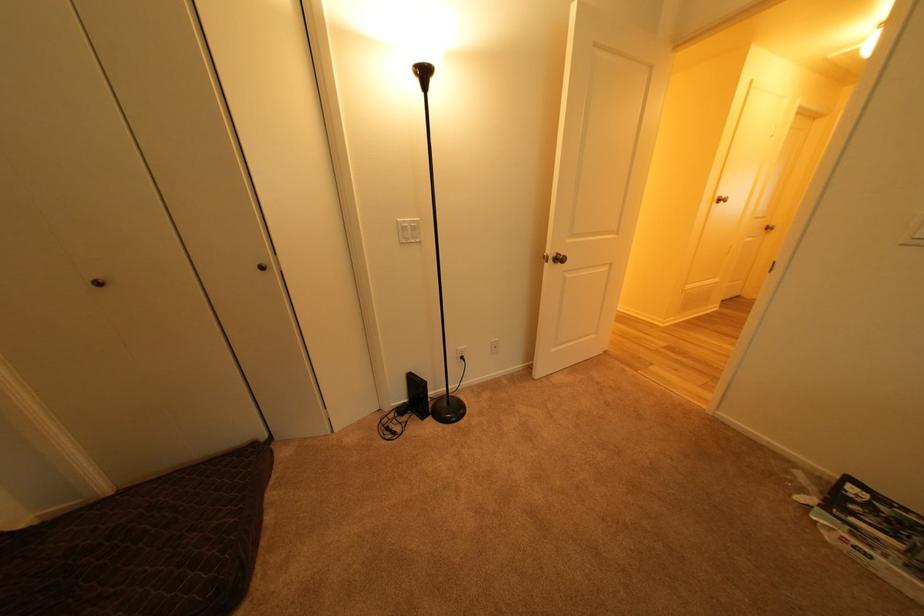
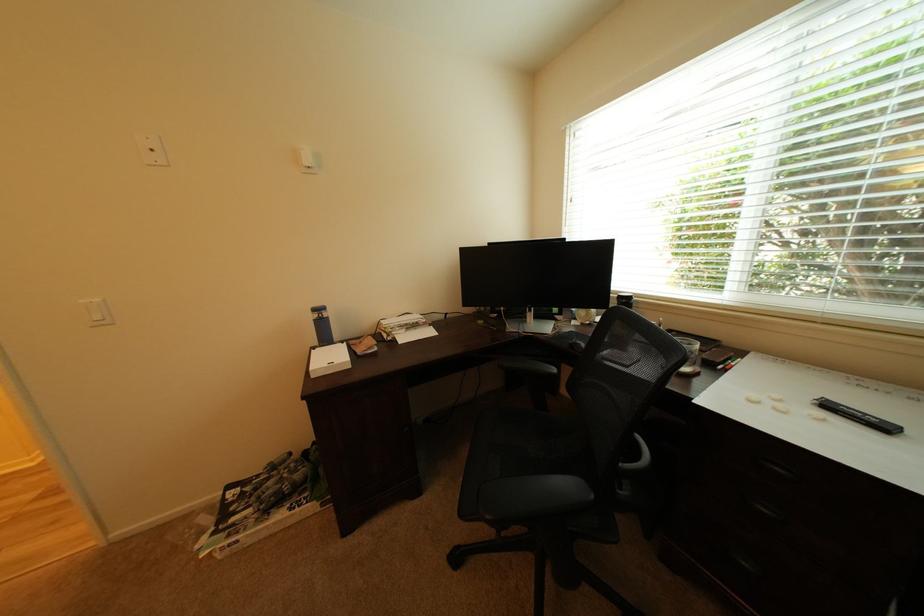
The point at (881, 559) is marked in the first image. Where is the corresponding point in the second image?

(248, 543)